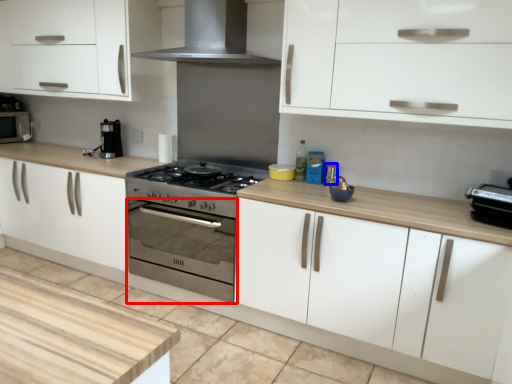
Question: Which point is further to the camera, oven (highlighted by a red box) or appliance (highlighted by a blue box)?

Choices:
 (A) oven
 (B) appliance

Answer: (B)